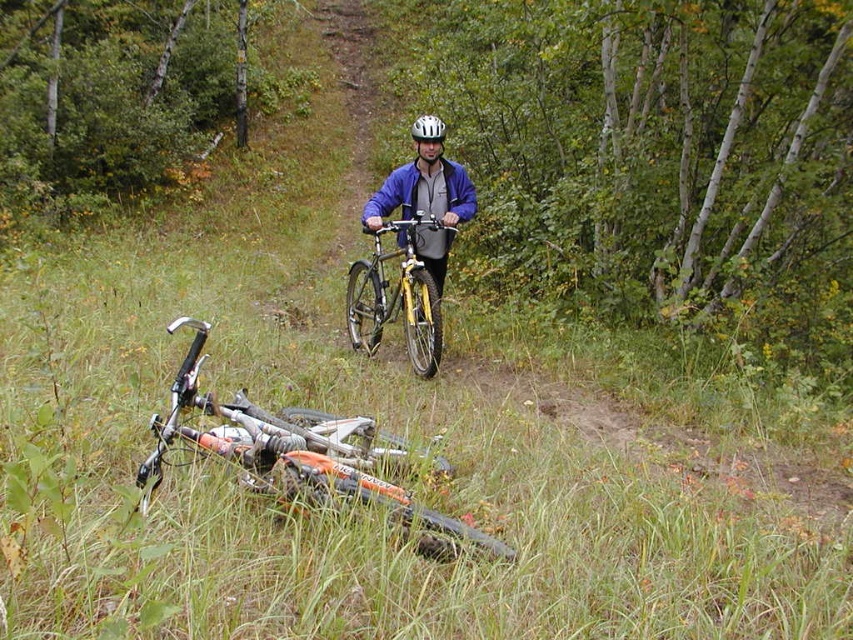
How much distance is there between yellow metallic bicycle at center and white matte bicycle helmet at center?

yellow metallic bicycle at center is 1.38 meters from white matte bicycle helmet at center.

The width and height of the screenshot is (853, 640). Describe the element at coordinates (398, 298) in the screenshot. I see `yellow metallic bicycle at center` at that location.

Find the location of a particular element. yellow metallic bicycle at center is located at coordinates (398, 298).

Is orange matte mountain bike at lower left to the left of white matte bicycle helmet at center from the viewer's perspective?

Yes, orange matte mountain bike at lower left is to the left of white matte bicycle helmet at center.

Which is behind, point (247, 464) or point (412, 122)?

Positioned behind is point (412, 122).

This screenshot has width=853, height=640. Identify the location of orange matte mountain bike at lower left. (299, 454).

Who is more forward, (245,480) or (387,221)?

Point (245,480)

Who is lower down, orange matte mountain bike at lower left or yellow metallic bicycle at center?

orange matte mountain bike at lower left

In order to click on orange matte mountain bike at lower left in this screenshot , I will do `click(299, 454)`.

Where is `orange matte mountain bike at lower left`? This screenshot has width=853, height=640. orange matte mountain bike at lower left is located at coordinates (299, 454).